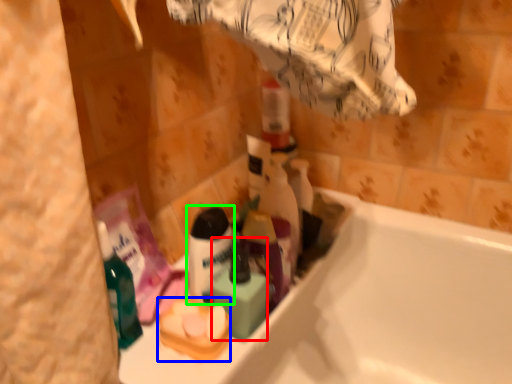
Question: Which is farther away from mouthwash (highlighted by a red box)? product (highlighted by a blue box) or shaving cream (highlighted by a green box)?

Choices:
 (A) product
 (B) shaving cream

Answer: (A)